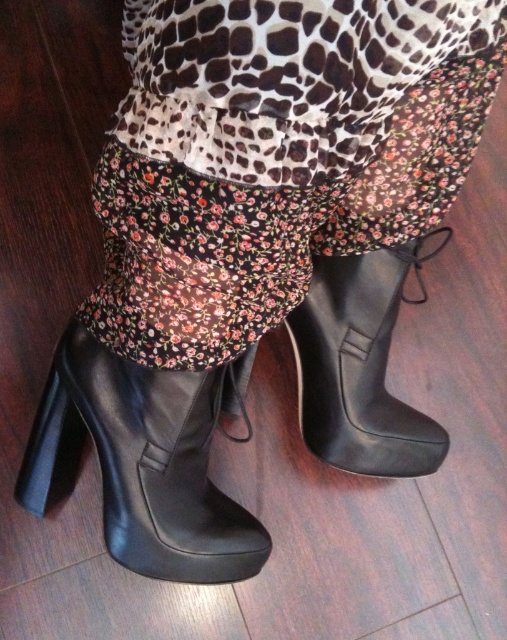
You are a fashion designer observing the image. You need to determine the arrangement of the two items in the outfit. Which item is positioned higher on the body between the floral fabric skirt at center and the black leather boot at lower left?

The floral fabric skirt at center is positioned higher on the body than the black leather boot at lower left.

You are a photographer setting up a shoot and need to position two black leather boots in a specific arrangement. You have the black leather boot at lower left and the black leather boot at lower center. According to the scene, which boot is located more to the left?

The black leather boot at lower left is positioned more to the left compared to the black leather boot at lower center.

From the picture: You are a fashion designer trying to create a matching outfit. You have a floral fabric skirt at center and a black leather boot at lower left. Can you determine if there is enough space between them to add a belt in between?

The floral fabric skirt at center and black leather boot at lower left are 10.88 inches apart from each other. A typical belt is about 3 inches wide, so there is sufficient space to add a belt between them.